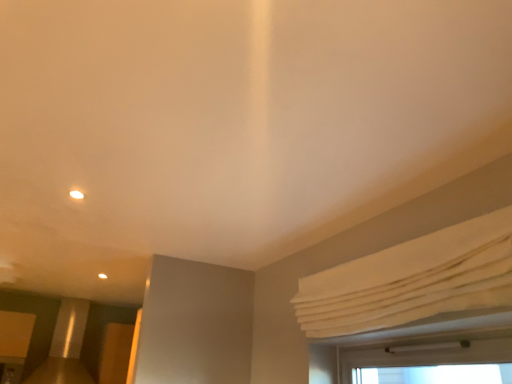
Where is `white fabric curtain at upper right`? Image resolution: width=512 pixels, height=384 pixels. white fabric curtain at upper right is located at coordinates (412, 280).

Describe the element at coordinates (412, 280) in the screenshot. The width and height of the screenshot is (512, 384). I see `white fabric curtain at upper right` at that location.

This screenshot has width=512, height=384. Identify the location of white fabric curtain at upper right. (412, 280).